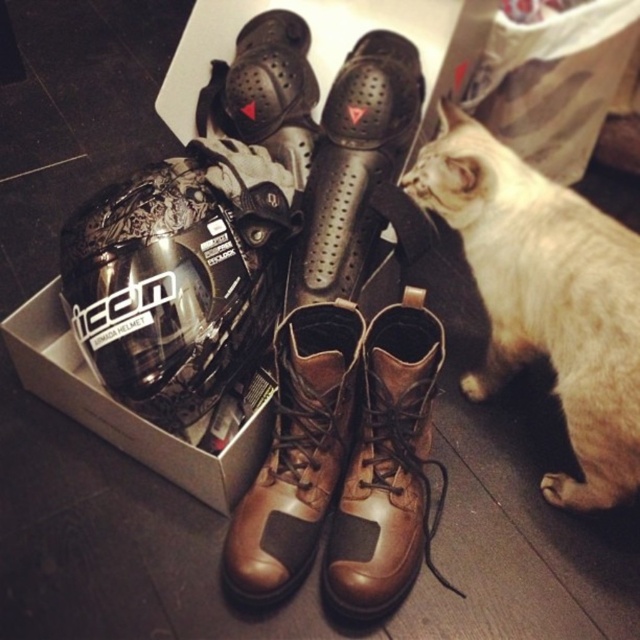
Question: Which object is the closest to the white fur cat at lower right?

Choices:
 (A) metallic silver helmet at upper left
 (B) brown leather boots at center
 (C) brown leather boot at center

Answer: (C)

Question: Which point appears farthest from the camera in this image?

Choices:
 (A) (45, 310)
 (B) (250, 566)

Answer: (A)

Question: Does white fur cat at lower right appear on the left side of brown leather boot at center?

Choices:
 (A) yes
 (B) no

Answer: (B)

Question: Does white fur cat at lower right appear on the right side of brown leather boots at center?

Choices:
 (A) yes
 (B) no

Answer: (A)

Question: Which of the following is the farthest from the observer?

Choices:
 (A) brown leather boot at center
 (B) brown leather boots at center
 (C) white fur cat at lower right
 (D) metallic silver helmet at upper left

Answer: (D)

Question: Is white fur cat at lower right smaller than brown leather boots at center?

Choices:
 (A) yes
 (B) no

Answer: (B)